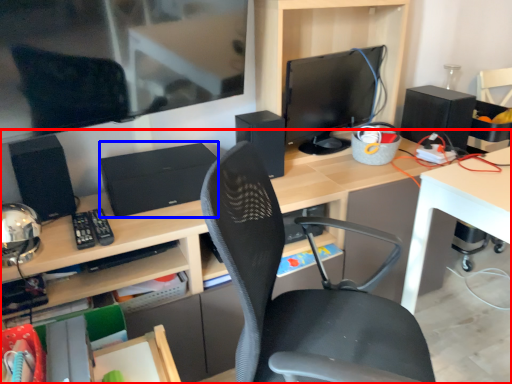
Question: Which object appears farthest to the camera in this image, desk (highlighted by a red box) or computer (highlighted by a blue box)?

Choices:
 (A) desk
 (B) computer

Answer: (B)